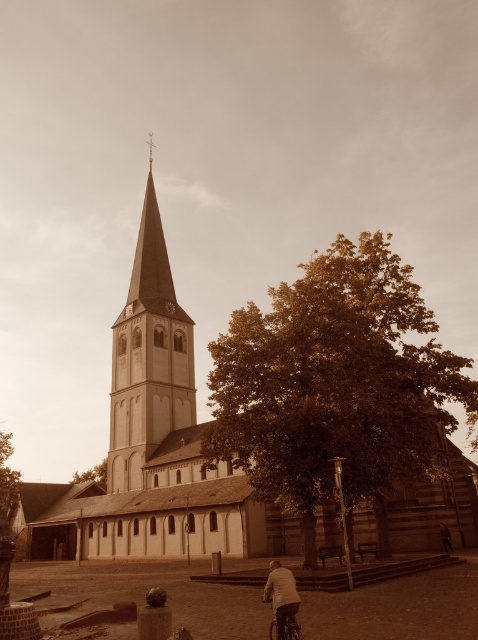
Who is higher up, smooth stone spire at center or light brown leather jacket at lower right?

smooth stone spire at center

Does smooth stone spire at center have a larger size compared to light brown leather jacket at lower right?

Correct, smooth stone spire at center is larger in size than light brown leather jacket at lower right.

The width and height of the screenshot is (478, 640). Describe the element at coordinates (149, 356) in the screenshot. I see `smooth stone spire at center` at that location.

At what (x,y) coordinates should I click in order to perform the action: click on smooth stone spire at center. Please return your answer as a coordinate pair (x, y). This screenshot has width=478, height=640. Looking at the image, I should click on (149, 356).

Is the position of smooth stone spire at center more distant than that of shiny metallic bicycle at lower center?

Yes, smooth stone spire at center is further from the viewer.

Where is `smooth stone spire at center`? This screenshot has height=640, width=478. smooth stone spire at center is located at coordinates (149, 356).

Is point (147, 452) closer to viewer compared to point (271, 600)?

No.

In order to click on smooth stone spire at center in this screenshot , I will do `click(149, 356)`.

What do you see at coordinates (281, 595) in the screenshot?
I see `light brown leather jacket at lower right` at bounding box center [281, 595].

Locate an element on the screen. light brown leather jacket at lower right is located at coordinates (281, 595).

Does point (271, 582) lie behind point (284, 608)?

Yes.

I want to click on light brown leather jacket at lower right, so click(x=281, y=595).